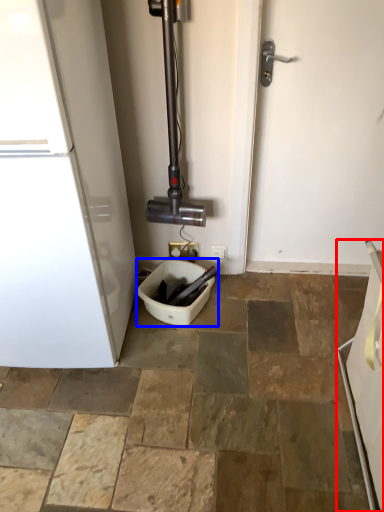
Question: Among these objects, which one is farthest to the camera, appliance (highlighted by a red box) or toilet bowl (highlighted by a blue box)?

Choices:
 (A) appliance
 (B) toilet bowl

Answer: (B)